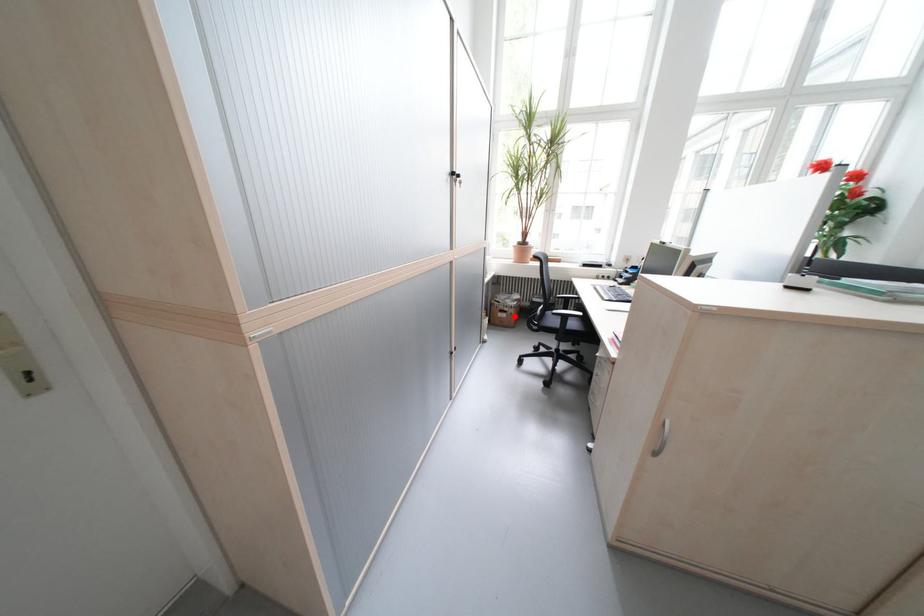
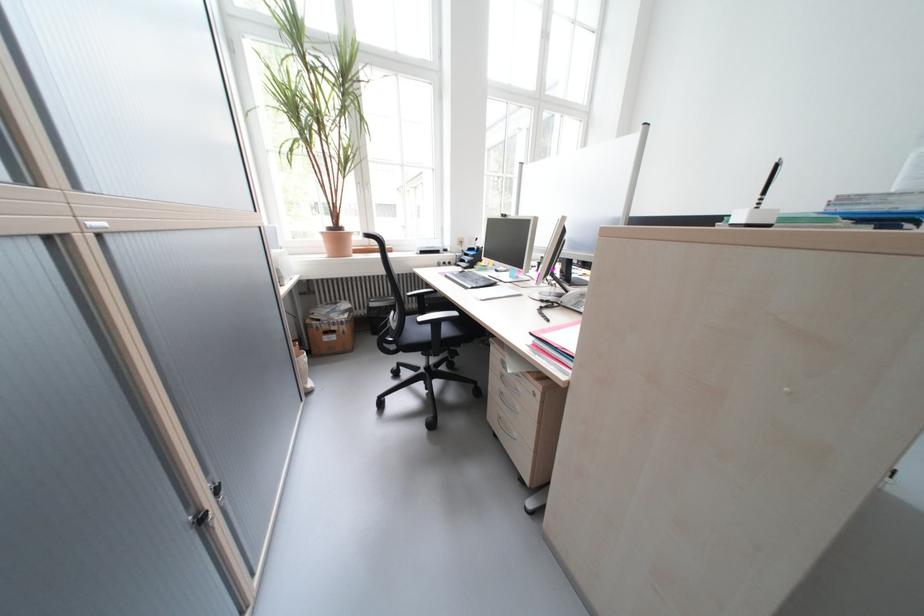
Find the pixel in the second image that matches the highlighted location in the first image.

(344, 339)